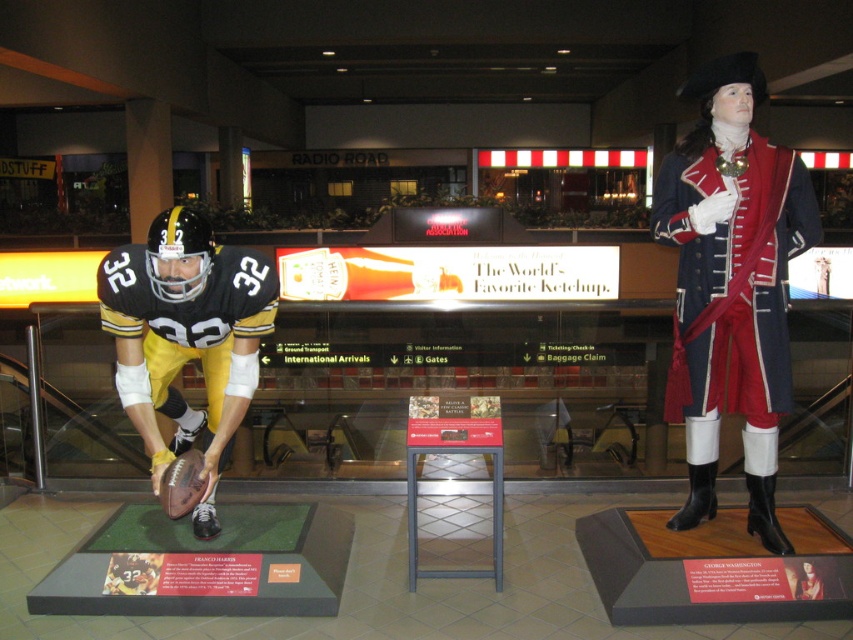
Based on the photo, which is more to the right, blue wool coat at right or matte black uniform at left?

blue wool coat at right is more to the right.

Who is shorter, blue wool coat at right or matte black uniform at left?

matte black uniform at left is shorter.

Does point (734, 285) come behind point (193, 428)?

No, it is in front of (193, 428).

The width and height of the screenshot is (853, 640). Find the location of `blue wool coat at right`. blue wool coat at right is located at coordinates (730, 285).